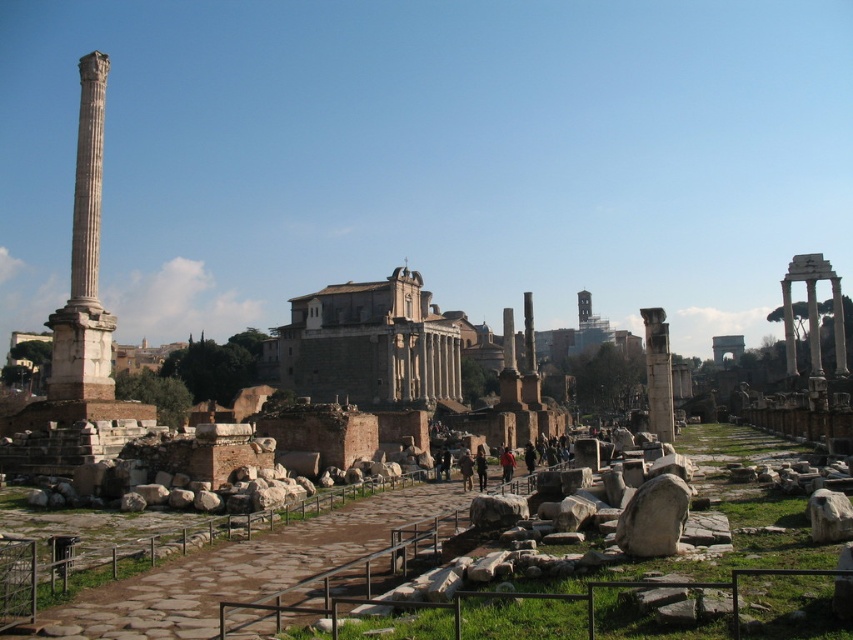
Is smooth stone column at left wider than smooth stone column at center?

In fact, smooth stone column at left might be narrower than smooth stone column at center.

Between point (90, 285) and point (663, 353), which one is positioned behind?

The point (663, 353) is more distant.

Who is more distant from viewer, (102, 60) or (654, 308)?

Positioned behind is point (654, 308).

Find the location of a particular element. Image resolution: width=853 pixels, height=640 pixels. smooth stone column at left is located at coordinates (84, 259).

Between point (364, 310) and point (102, 369), which one is positioned in front?

Positioned in front is point (102, 369).

Is smooth gray stone temple at center to the right of smooth stone column at left from the viewer's perspective?

Yes, smooth gray stone temple at center is to the right of smooth stone column at left.

In order to click on smooth gray stone temple at center in this screenshot , I will do `click(369, 344)`.

Is the position of smooth gray stone temple at center more distant than that of smooth stone column at center?

Yes, it is behind smooth stone column at center.

Does smooth gray stone temple at center appear over smooth stone column at center?

Yes.

Describe the element at coordinates (369, 344) in the screenshot. I see `smooth gray stone temple at center` at that location.

The width and height of the screenshot is (853, 640). Identify the location of smooth gray stone temple at center. (369, 344).